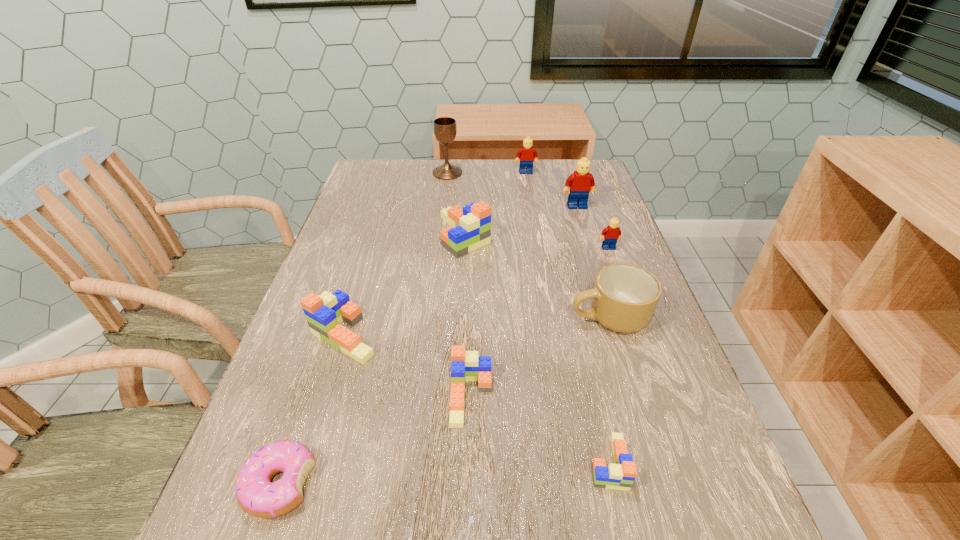
This screenshot has height=540, width=960. Find the location of `free space located 0.370m on the side with the handle of the mug`. free space located 0.370m on the side with the handle of the mug is located at coordinates (396, 318).

Where is `free space located 0.060m on the side with the handle of the mug`? This screenshot has height=540, width=960. free space located 0.060m on the side with the handle of the mug is located at coordinates (540, 318).

Where is `free region located 0.050m on the front of the second farthest orange Lego`? The height and width of the screenshot is (540, 960). free region located 0.050m on the front of the second farthest orange Lego is located at coordinates (328, 387).

In order to click on blank space located 0.060m on the front-facing side of the smallest yellow Lego in this screenshot , I will do `click(614, 265)`.

Find the location of a particular element. free space located on the right of the eighth tallest object is located at coordinates (674, 397).

Where is `free location located 0.370m on the back of the rightmost orange Lego`? The height and width of the screenshot is (540, 960). free location located 0.370m on the back of the rightmost orange Lego is located at coordinates (569, 288).

Where is `vacant space located on the right of the pink doughnut`? vacant space located on the right of the pink doughnut is located at coordinates click(x=515, y=484).

This screenshot has height=540, width=960. I want to click on chalice located at the far edge, so 445,129.

I want to click on Lego that is at the far edge, so click(527, 154).

Where is `Lego that is at the left edge`? The width and height of the screenshot is (960, 540). Lego that is at the left edge is located at coordinates (324, 313).